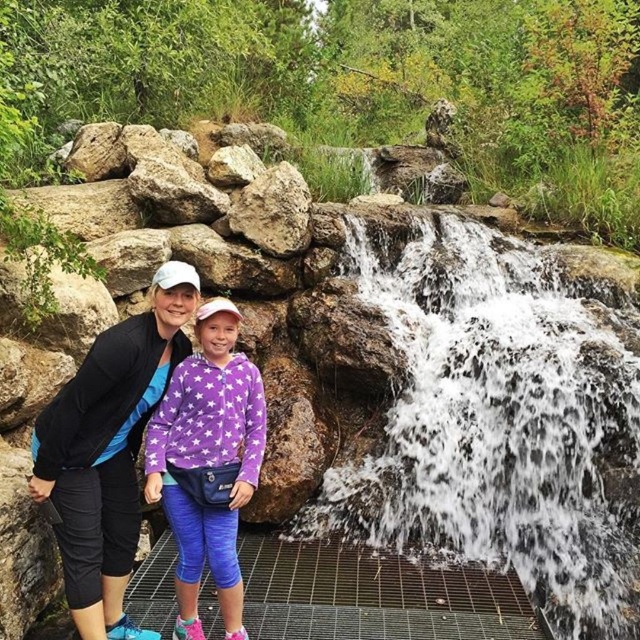
You are standing at the point marked as point [108,451] in the image. Looking around, you see the adult in a black jacket at left and the child in a purple hoodie at right. Which direction should you face to see the adult in a black jacket at left?

The point [108,451] is located on the matte black jacket at left, so facing towards the adult in the black jacket at left would mean looking to your left side.

You are standing in front of the waterfall and want to take a photo of the white frothy water at center and the gray rough rock at center. Which object is located below the other?

The white frothy water at center is positioned under the gray rough rock at center, so the water is below the rock.

You are planning to take a photo of the white frothy water at center and the matte black jacket at left. Which object should you focus on first if you want to capture both in the same frame without moving the camera?

The white frothy water at center is larger in size than the matte black jacket at left, so you should focus on the larger object first to ensure it fits properly in the frame.